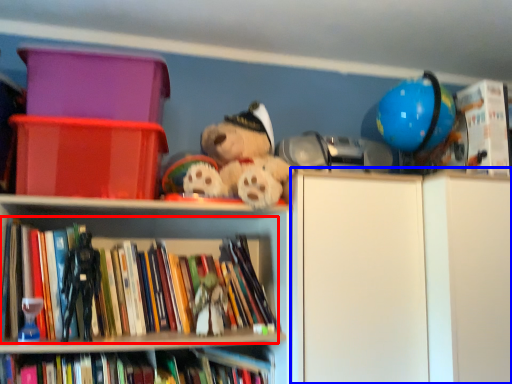
Question: Which object appears farthest to the camera in this image, book (highlighted by a red box) or cabinetry (highlighted by a blue box)?

Choices:
 (A) book
 (B) cabinetry

Answer: (B)